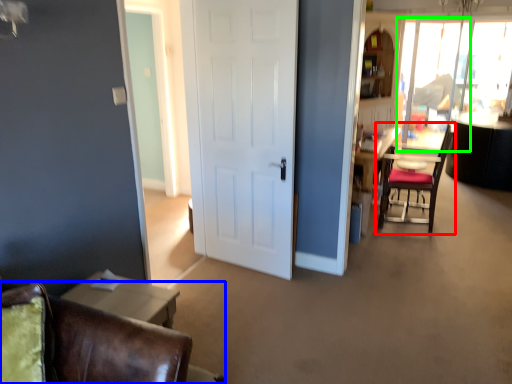
Question: Considering the real-world distances, which object is farthest from chair (highlighted by a red box)? chair (highlighted by a blue box) or window screen (highlighted by a green box)?

Choices:
 (A) chair
 (B) window screen

Answer: (A)